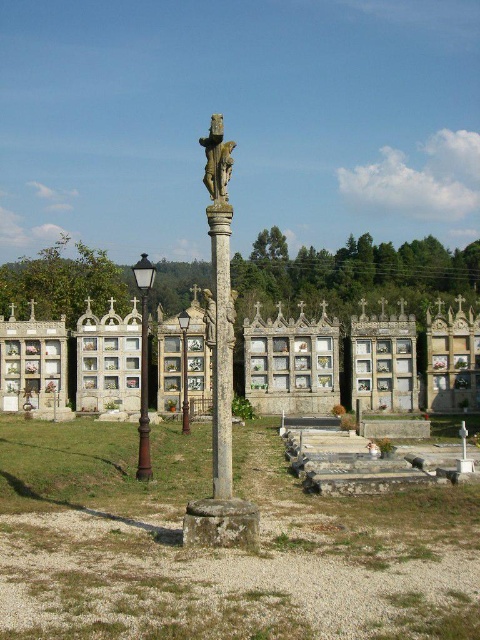
Between bronze/brass streetlamp at left and polished stone statue at center, which one is positioned higher?

Positioned higher is polished stone statue at center.

Is point (144, 300) positioned after point (210, 148)?

Yes, it is.

Identify the location of bronze/brass streetlamp at left. (144, 365).

Who is higher up, smooth stone column at center or metallic lamp post at center?

smooth stone column at center

Who is more distant from viewer, (228, 280) or (182, 385)?

Point (182, 385)

Where is `smooth stone column at center`? This screenshot has width=480, height=640. smooth stone column at center is located at coordinates (222, 349).

Does polished stone statue at center appear on the right side of metallic lamp post at center?

Correct, you'll find polished stone statue at center to the right of metallic lamp post at center.

Which is more to the right, polished stone statue at center or metallic lamp post at center?

Positioned to the right is polished stone statue at center.

Locate an element on the screen. This screenshot has height=640, width=480. polished stone statue at center is located at coordinates (216, 160).